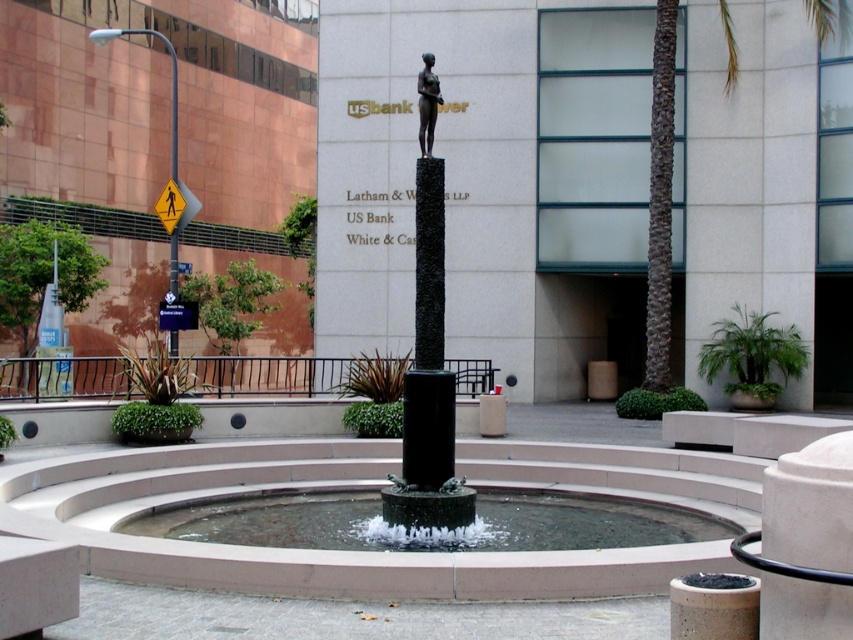
Question: Which is nearer to the bronze statue at center?

Choices:
 (A) metallic reflective street sign at center
 (B) clear glass water at center

Answer: (B)

Question: Is clear glass water at center bigger than yellow reflective plastic pedestrian sign at upper left?

Choices:
 (A) yes
 (B) no

Answer: (B)

Question: From the image, what is the correct spatial relationship of clear glass water at center in relation to yellow reflective plastic pedestrian sign at upper left?

Choices:
 (A) below
 (B) above

Answer: (A)

Question: Which of the following is the farthest from the observer?

Choices:
 (A) tap(595, 516)
 (B) tap(196, 204)
 (C) tap(436, 112)

Answer: (B)

Question: From the image, what is the correct spatial relationship of bronze statue at center in relation to yellow reflective plastic pedestrian sign at upper left?

Choices:
 (A) above
 (B) below

Answer: (B)

Question: Which point is farther to the camera?

Choices:
 (A) (431, 540)
 (B) (171, 202)
 (C) (431, 138)
 (D) (161, 305)

Answer: (B)